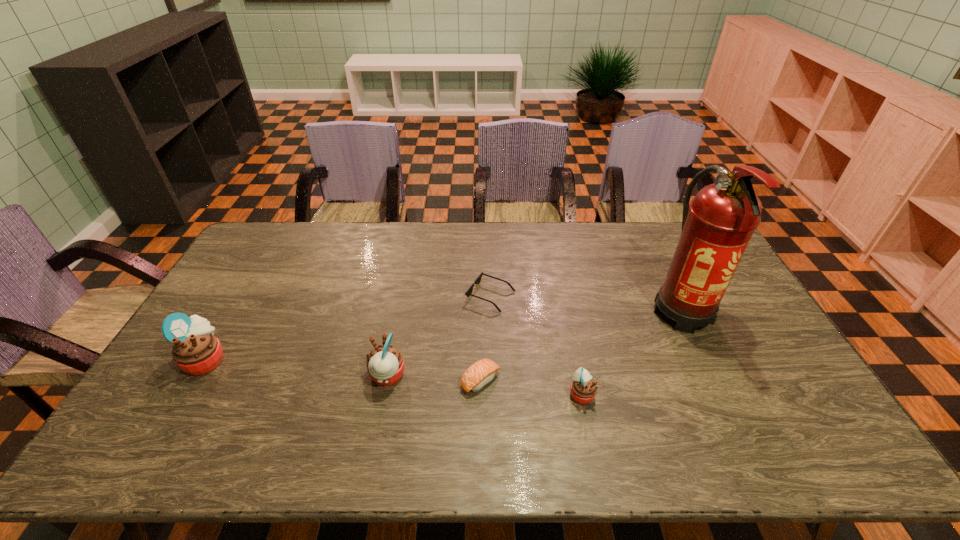
Where is `free region located 0.160m on the front-facing side of the fifth object from right to left`? The width and height of the screenshot is (960, 540). free region located 0.160m on the front-facing side of the fifth object from right to left is located at coordinates (x=310, y=376).

Where is `vacant space located on the front-facing side of the fifth object from right to left`? The image size is (960, 540). vacant space located on the front-facing side of the fifth object from right to left is located at coordinates (225, 376).

Locate an element on the screen. The image size is (960, 540). vacant space located 0.300m on the front-facing side of the fifth object from right to left is located at coordinates (258, 376).

At what (x,y) coordinates should I click in order to perform the action: click on vacant area situated on the front-facing side of the shortest muffin. Please return your answer as a coordinate pair (x, y). Looking at the image, I should click on (644, 394).

In order to click on vacant space located on the front-facing side of the tallest object in this screenshot , I will do `click(729, 407)`.

You are a GUI agent. You are given a task and a screenshot of the screen. Output one action in this format:
    pyautogui.click(x=<x>, y=<y>)
    Task: Click on the vacant region located on the lenses of the shortest object
    
    Given the screenshot: What is the action you would take?
    pyautogui.click(x=413, y=296)

Locate an element on the screen. This screenshot has height=540, width=960. free spot located 0.230m on the lenses of the shortest object is located at coordinates (395, 296).

This screenshot has width=960, height=540. Identify the location of free spot located 0.360m on the lenses of the shortest object. (354, 296).

Identify the location of free location located 0.220m on the back of the second shortest object. This screenshot has height=540, width=960. (x=481, y=309).

At what (x,y) coordinates should I click in order to perform the action: click on sushi at the near edge. Please return your answer as a coordinate pair (x, y). Looking at the image, I should click on (482, 372).